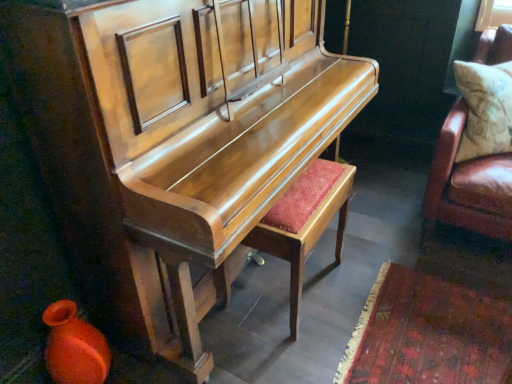
Question: Is leather cushion at right, positioned as the 2th furniture in left-to-right order, thinner than matte orange vase at lower left?

Choices:
 (A) yes
 (B) no

Answer: (B)

Question: Is leather cushion at right, positioned as the 2th furniture in left-to-right order, positioned in front of matte orange vase at lower left?

Choices:
 (A) no
 (B) yes

Answer: (A)

Question: Is leather cushion at right, positioned as the 2th furniture in left-to-right order, at the right side of matte orange vase at lower left?

Choices:
 (A) no
 (B) yes

Answer: (B)

Question: From a real-world perspective, is leather cushion at right, placed as the first furniture when sorted from right to left, physically below matte orange vase at lower left?

Choices:
 (A) no
 (B) yes

Answer: (A)

Question: Would you say matte orange vase at lower left is part of leather cushion at right, placed as the first furniture when sorted from right to left,'s contents?

Choices:
 (A) no
 (B) yes

Answer: (A)

Question: Is leather cushion at right, positioned as the 2th furniture in left-to-right order, bigger or smaller than matte wood stool at center?

Choices:
 (A) small
 (B) big

Answer: (A)

Question: From a real-world perspective, is leather cushion at right, positioned as the 2th furniture in left-to-right order, above or below matte wood stool at center?

Choices:
 (A) above
 (B) below

Answer: (A)

Question: Is point (430, 180) closer or farther from the camera than point (295, 317)?

Choices:
 (A) farther
 (B) closer

Answer: (A)

Question: Considering the positions of leather cushion at right, positioned as the 2th furniture in left-to-right order, and matte wood stool at center in the image, is leather cushion at right, positioned as the 2th furniture in left-to-right order, taller or shorter than matte wood stool at center?

Choices:
 (A) tall
 (B) short

Answer: (B)

Question: Considering the positions of matte orange vase at lower left and leather cushion at right, positioned as the 2th furniture in left-to-right order, in the image, is matte orange vase at lower left taller or shorter than leather cushion at right, positioned as the 2th furniture in left-to-right order,?

Choices:
 (A) short
 (B) tall

Answer: (A)

Question: From the image's perspective, is matte orange vase at lower left above or below leather cushion at right, positioned as the 2th furniture in left-to-right order?

Choices:
 (A) above
 (B) below

Answer: (B)

Question: Is point (95, 352) closer or farther from the camera than point (492, 31)?

Choices:
 (A) farther
 (B) closer

Answer: (B)

Question: From a real-world perspective, relative to leather cushion at right, placed as the first furniture when sorted from right to left, is matte orange vase at lower left vertically above or below?

Choices:
 (A) below
 (B) above

Answer: (A)

Question: Looking at the image, does leather cushion at right, placed as the first furniture when sorted from right to left, seem bigger or smaller compared to shiny wood piano at center, which ranks as the first furniture in left-to-right order?

Choices:
 (A) big
 (B) small

Answer: (B)

Question: Is leather cushion at right, positioned as the 2th furniture in left-to-right order, taller or shorter than shiny wood piano at center, the 2th furniture when ordered from right to left?

Choices:
 (A) tall
 (B) short

Answer: (B)